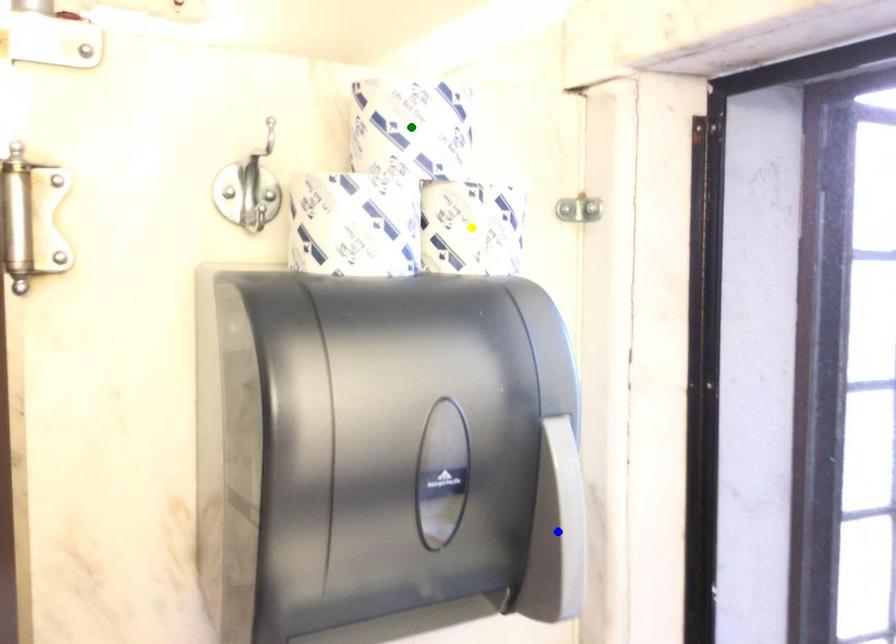
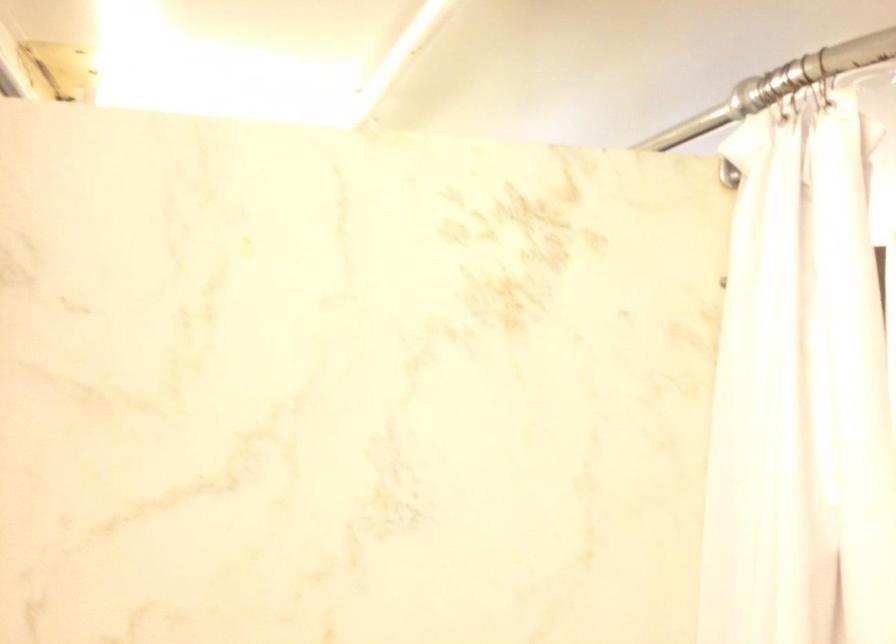
I am providing you with two images of the same scene from different viewpoints. Three points are marked in image1. Which point corresponds to a part or object that is occluded in image2?In image1, three points are marked. Which of them correspond to a part or object that is occluded in image2?Among the three points shown in image1, which one corresponds to a part or object that is no longer visible due to occlusion in image2?

blue point, yellow point, green point